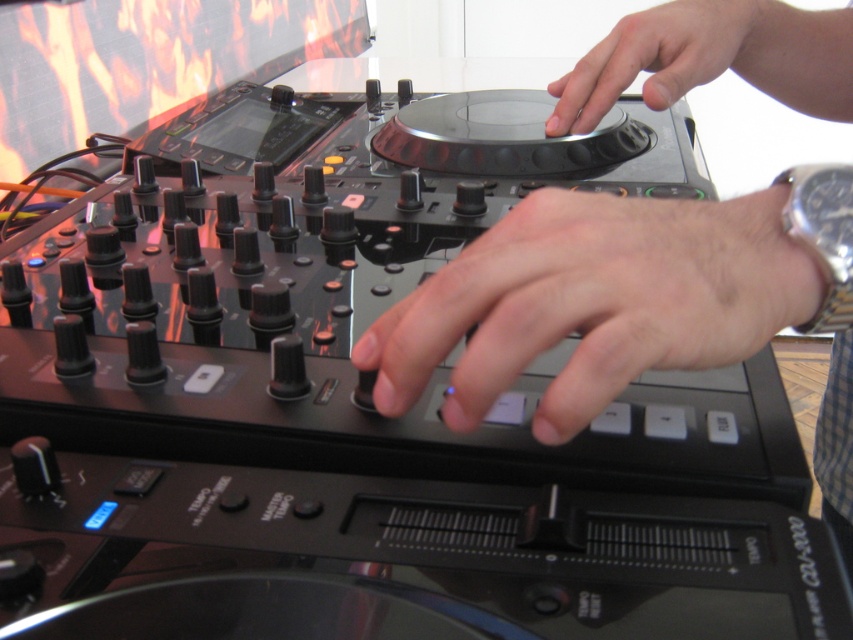
You are a DJ trying to reach the matte black turntable at center while your hand is currently at the smooth skin hand at center. Which direction should you move your hand to get closer to the turntable?

The smooth skin hand at center is already closer to the viewer than the matte black turntable at center, so you should move your hand backward to get closer to the matte black turntable at center.

You are a DJ trying to reach the turntable on the DJ mixing console. Your hand is currently at the point marked by point (593, 301). In which direction should you move your hand to reach the turntable?

The turntable is located in the central area of the DJ mixing console, so to reach it from point (593, 301), move your hand towards the center.